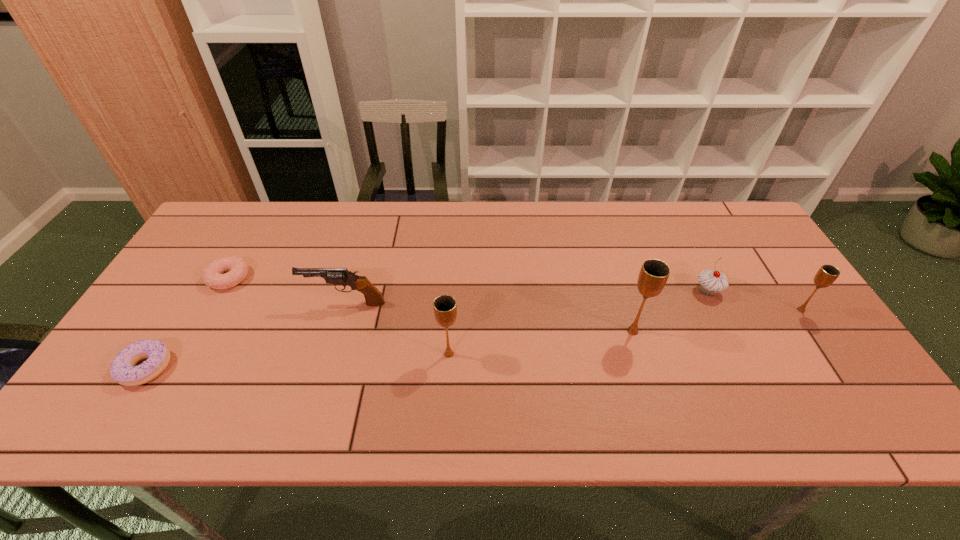
I want to click on object that stands as the sixth closest to the rightmost chalice, so tap(122, 369).

At what (x,y) coordinates should I click in order to perform the action: click on chalice that stands as the second closest to the farther doughnut. Please return your answer as a coordinate pair (x, y). The image size is (960, 540). Looking at the image, I should click on (654, 273).

What are the coordinates of `the second closest chalice relative to the tallest chalice` in the screenshot? It's located at (x=827, y=274).

This screenshot has width=960, height=540. I want to click on vacant region that satisfies the following two spatial constraints: 1. on the back side of the nearer doughnut; 2. along the barrel of the gun, so [x=186, y=303].

Where is `vacant space that satisfies the following two spatial constraints: 1. along the barrel of the gun; 2. on the right side of the sixth object from left to right`? vacant space that satisfies the following two spatial constraints: 1. along the barrel of the gun; 2. on the right side of the sixth object from left to right is located at coordinates (348, 291).

The image size is (960, 540). I want to click on vacant region that satisfies the following two spatial constraints: 1. along the barrel of the second object from right to left; 2. on the left side of the third object from left to right, so click(x=348, y=291).